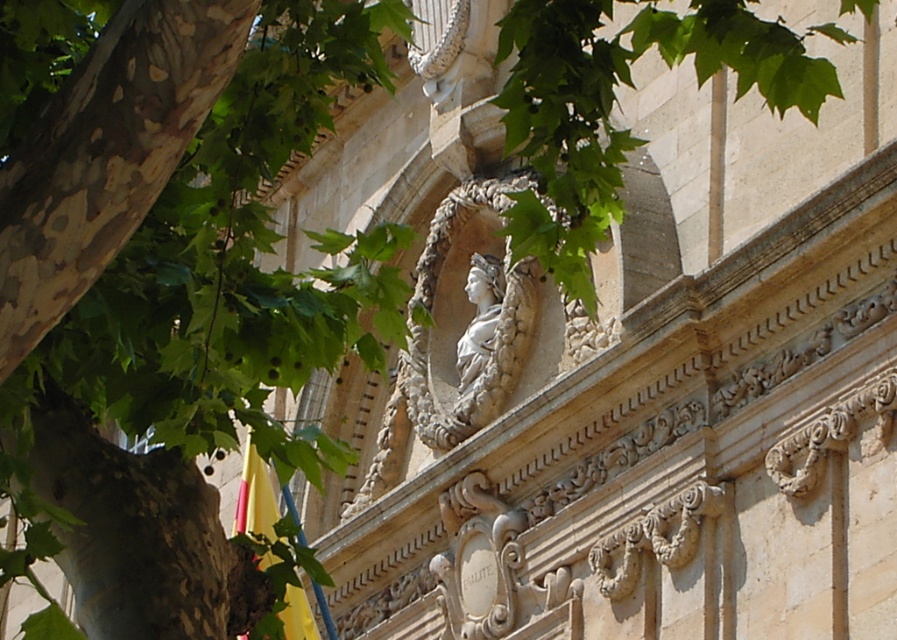
You are an architect analyzing the facade. You notice a point at coordinates (x=460, y=316). What does this point mark on the classical architectural facade?

The point at coordinates (x=460, y=316) marks the white stone bust at center.

You are an art conservator examining the classical facade. You notice the yellow fabric at lower left and the white marble bust at center. Which object is closer to the left edge of the image?

The yellow fabric at lower left is positioned on the left side of the white marble bust at center, so it is closer to the left edge of the image.

You are an art conservator examining the facade. You notice two busts at the center. Which one is closer to you, the white stone bust at center or the white marble bust at center?

The white stone bust at center is closer to you since it is in front of the white marble bust at center.